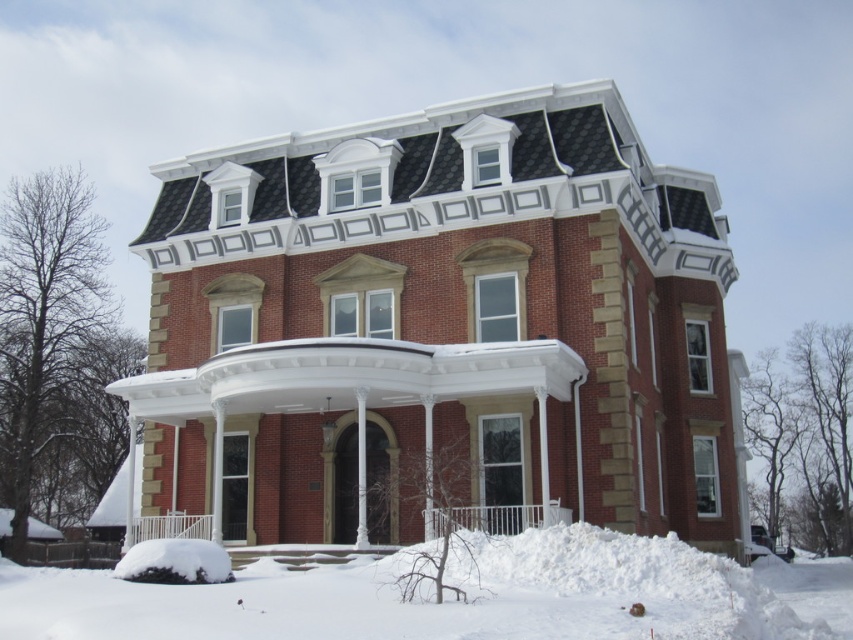
Which is above, white fluffy snow at lower center or white painted wood porch at center?

white painted wood porch at center is higher up.

Based on the photo, is white fluffy snow at lower center to the right of white painted wood porch at center from the viewer's perspective?

Correct, you'll find white fluffy snow at lower center to the right of white painted wood porch at center.

Where is `white fluffy snow at lower center`? white fluffy snow at lower center is located at coordinates (456, 602).